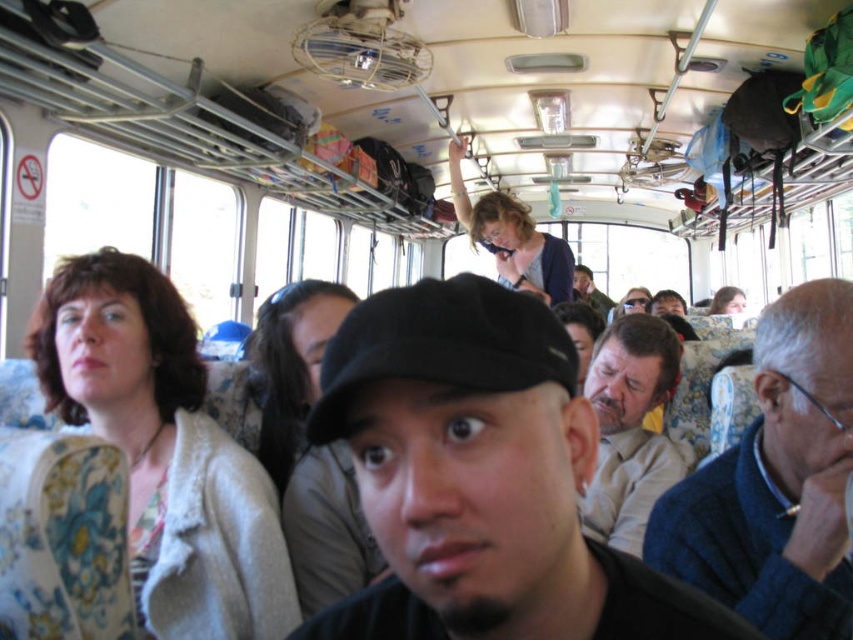
Which of these two, light beige shirt at center or dark brown leather jacket at upper center, stands taller?

With more height is dark brown leather jacket at upper center.

Does light beige shirt at center have a lesser height compared to dark brown leather jacket at upper center?

Yes, light beige shirt at center is shorter than dark brown leather jacket at upper center.

Between point (640, 442) and point (578, 272), which one is positioned behind?

The point (578, 272) is more distant.

I want to click on light beige shirt at center, so click(x=630, y=428).

Who is shorter, black matte cap at center or floral fabric jacket at left?

black matte cap at center

Does point (418, 468) lie behind point (233, 579)?

No, it is in front of (233, 579).

At what (x,y) coordinates should I click in order to perform the action: click on black matte cap at center. Please return your answer as a coordinate pair (x, y). The image size is (853, 640). Looking at the image, I should click on (480, 477).

Can you confirm if floral fabric jacket at left is bigger than light beige shirt at center?

Yes.

Can you confirm if floral fabric jacket at left is taller than light beige shirt at center?

Yes.

Which is in front, point (117, 332) or point (598, 369)?

Point (117, 332) is in front.

Where is `floral fabric jacket at left`? The width and height of the screenshot is (853, 640). floral fabric jacket at left is located at coordinates (164, 451).